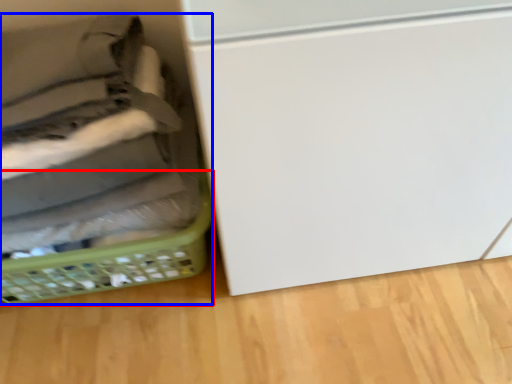
Question: Which object appears farthest to the camera in this image, basket (highlighted by a red box) or basket (highlighted by a blue box)?

Choices:
 (A) basket
 (B) basket

Answer: (A)